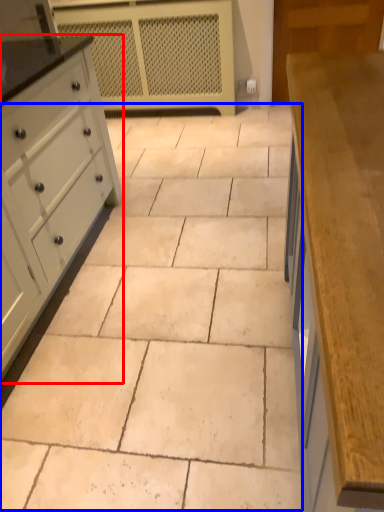
Question: Which object appears farthest to the camera in this image, chest of drawers (highlighted by a red box) or ceramic tile (highlighted by a blue box)?

Choices:
 (A) chest of drawers
 (B) ceramic tile

Answer: (A)